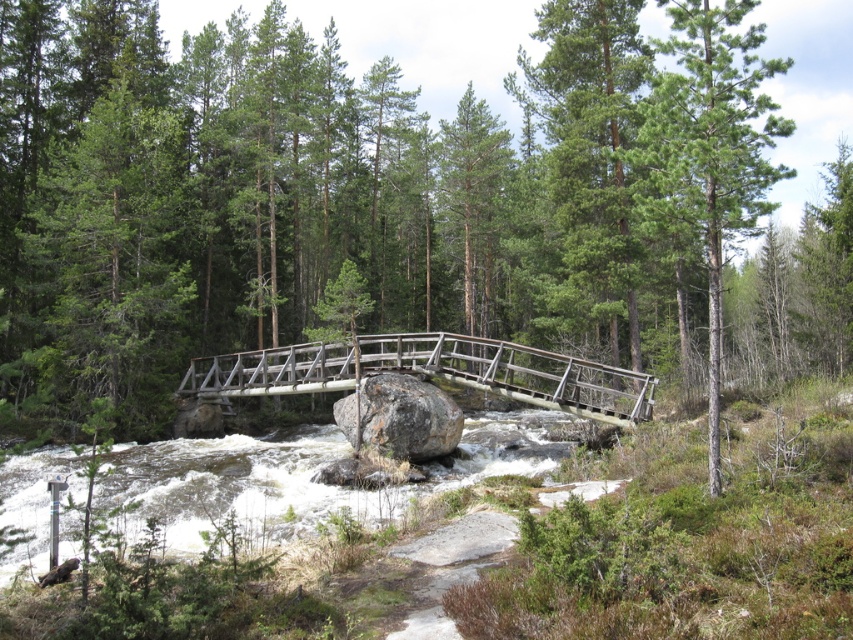
Question: Which of the following is the farthest from the observer?

Choices:
 (A) white frothy water at center
 (B) green rough bark tree at upper center
 (C) green matte tree at upper left

Answer: (B)

Question: Is green matte tree at upper left bigger than green rough bark tree at upper center?

Choices:
 (A) yes
 (B) no

Answer: (B)

Question: Does green matte tree at upper left have a lesser width compared to green rough bark tree at upper center?

Choices:
 (A) yes
 (B) no

Answer: (A)

Question: Which object appears farthest from the camera in this image?

Choices:
 (A) green rough bark tree at upper center
 (B) green matte tree at upper left
 (C) wooden bridge at center
 (D) white frothy water at center

Answer: (C)

Question: Is green matte tree at upper left bigger than green rough bark tree at upper center?

Choices:
 (A) yes
 (B) no

Answer: (B)

Question: Which object is closer to the camera taking this photo?

Choices:
 (A) wooden bridge at center
 (B) green rough bark tree at upper center

Answer: (B)